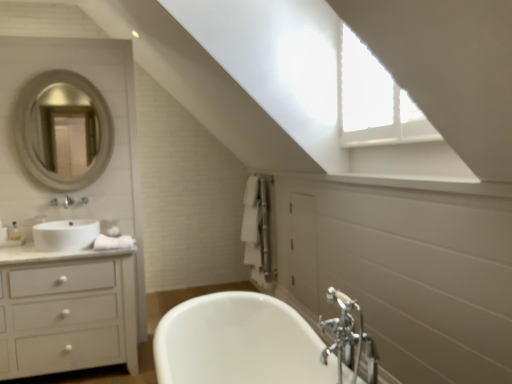
Question: From the image's perspective, is white glossy cabinet at left located above or below white glossy sink at left?

Choices:
 (A) below
 (B) above

Answer: (A)

Question: Is white glossy cabinet at left wider or thinner than white glossy sink at left?

Choices:
 (A) wide
 (B) thin

Answer: (A)

Question: Estimate the real-world distances between objects in this image. Which object is farther from the silver metallic mirror at upper left?

Choices:
 (A) white glossy sink at left
 (B) chrome metallic faucet at lower right
 (C) white glossy cabinet at left

Answer: (B)

Question: Based on their relative distances, which object is farther from the silver metallic mirror at upper left?

Choices:
 (A) white glossy cabinet at left
 (B) chrome metallic faucet at lower right
 (C) white glossy sink at left

Answer: (B)